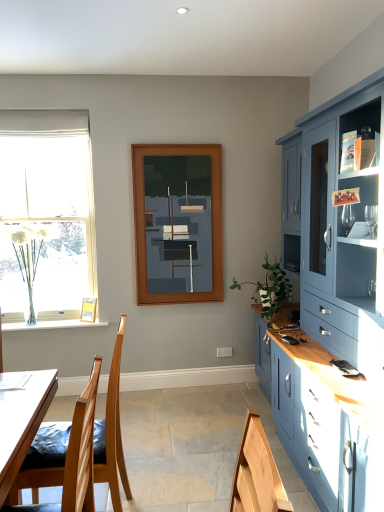
Question: Would you say wooden chair at lower left is outside clear glass vase at left?

Choices:
 (A) yes
 (B) no

Answer: (A)

Question: Does wooden chair at lower left turn towards clear glass vase at left?

Choices:
 (A) no
 (B) yes

Answer: (A)

Question: Is wooden chair at lower left not near clear glass vase at left?

Choices:
 (A) yes
 (B) no

Answer: (A)

Question: Can you confirm if wooden chair at lower left is thinner than clear glass vase at left?

Choices:
 (A) yes
 (B) no

Answer: (B)

Question: From the image's perspective, is wooden chair at lower left beneath clear glass vase at left?

Choices:
 (A) yes
 (B) no

Answer: (A)

Question: Based on their sizes in the image, would you say wooden picture frame at lower left is bigger or smaller than matte wooden frame at center?

Choices:
 (A) big
 (B) small

Answer: (B)

Question: In terms of height, does wooden picture frame at lower left look taller or shorter compared to matte wooden frame at center?

Choices:
 (A) short
 (B) tall

Answer: (A)

Question: In the image, is wooden picture frame at lower left on the left side or the right side of matte wooden frame at center?

Choices:
 (A) left
 (B) right

Answer: (A)

Question: From a real-world perspective, is wooden picture frame at lower left above or below matte wooden frame at center?

Choices:
 (A) above
 (B) below

Answer: (B)

Question: Is matte wooden frame at center bigger or smaller than wooden picture frame at lower left?

Choices:
 (A) small
 (B) big

Answer: (B)

Question: From the image's perspective, is matte wooden frame at center located above or below wooden picture frame at lower left?

Choices:
 (A) above
 (B) below

Answer: (A)

Question: Is point (190, 237) positioned closer to the camera than point (82, 301)?

Choices:
 (A) closer
 (B) farther

Answer: (A)

Question: From their relative heights in the image, would you say matte wooden frame at center is taller or shorter than wooden picture frame at lower left?

Choices:
 (A) short
 (B) tall

Answer: (B)

Question: Is wooden chair at lower left wider or thinner than wooden picture frame at lower left?

Choices:
 (A) wide
 (B) thin

Answer: (A)

Question: Considering the positions of wooden chair at lower left and wooden picture frame at lower left in the image, is wooden chair at lower left taller or shorter than wooden picture frame at lower left?

Choices:
 (A) tall
 (B) short

Answer: (A)